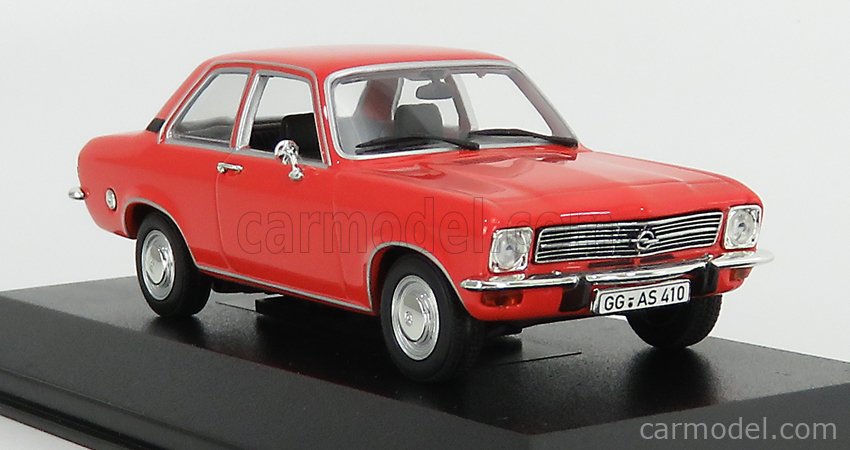
The height and width of the screenshot is (450, 850). Find the location of `hood`. hood is located at coordinates (564, 180).